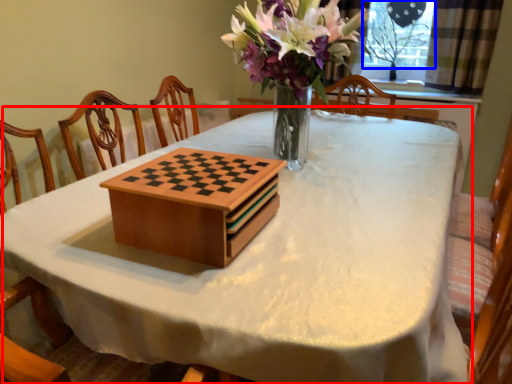
Question: Which point is closer to the camera, table (highlighted by a red box) or window screen (highlighted by a blue box)?

Choices:
 (A) table
 (B) window screen

Answer: (A)